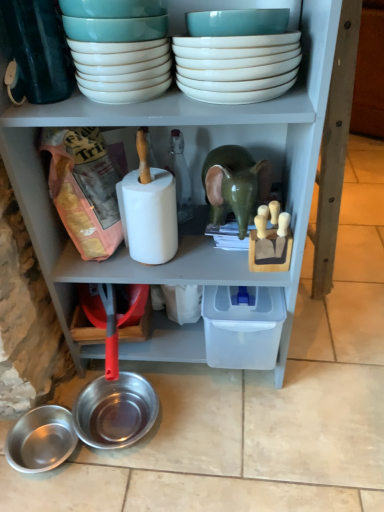
The width and height of the screenshot is (384, 512). What are the coordinates of `free location to the right of shiny metallic bowl at lower left, which ranks as the second bowl in bottom-to-top order` in the screenshot? It's located at (201, 428).